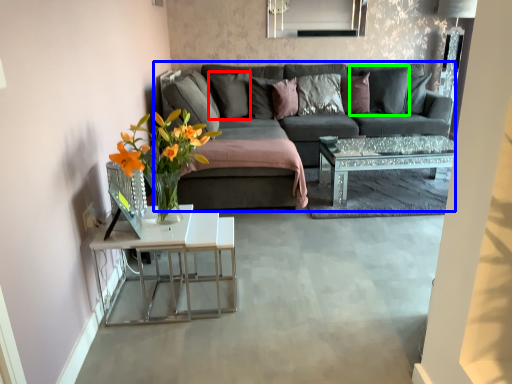
Question: Considering the real-world distances, which object is farthest from pillow (highlighted by a red box)? studio couch (highlighted by a blue box) or pillow (highlighted by a green box)?

Choices:
 (A) studio couch
 (B) pillow

Answer: (B)